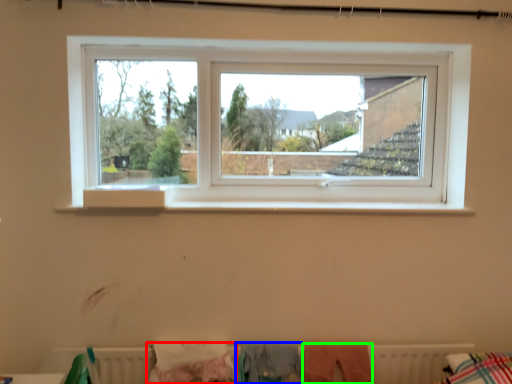
Question: Which object is positioned closest to clothing (highlighted by a red box)? Select from clothing (highlighted by a blue box) and clothing (highlighted by a green box).

Choices:
 (A) clothing
 (B) clothing

Answer: (A)